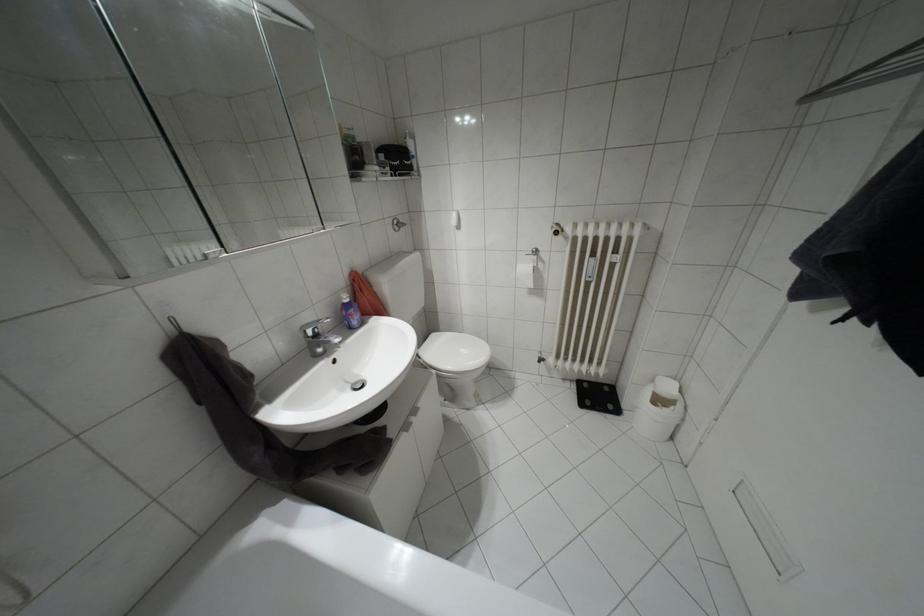
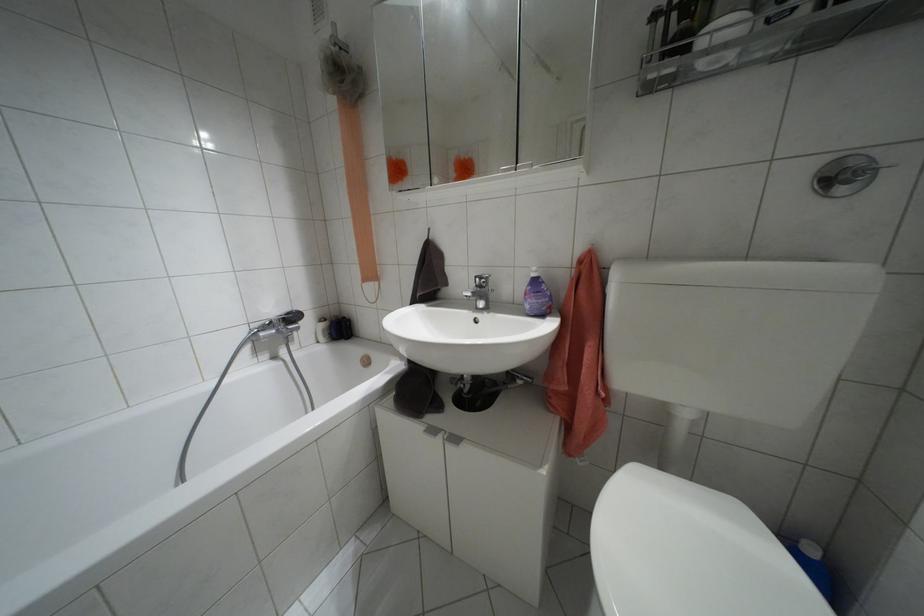
Find the pixel in the second image that matches point (406, 427) in the first image.

(432, 430)